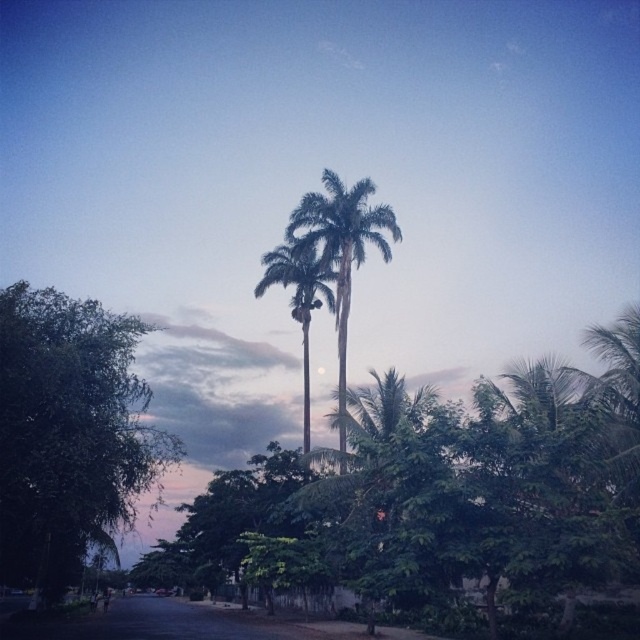
You are standing on the street and see the green leafy tree at left and the green leafy palm trees at center. Which one is more to the left?

The green leafy tree at left is more to the left than the green leafy palm trees at center.

You are standing at the point labeled point (100,524) and want to walk towards the point labeled point (269,253). Based on the scene description, which direction should you face to move towards it?

Since point (100,524) is closer to the camera than point (269,253), you should face away from the camera to move towards point (269,253).